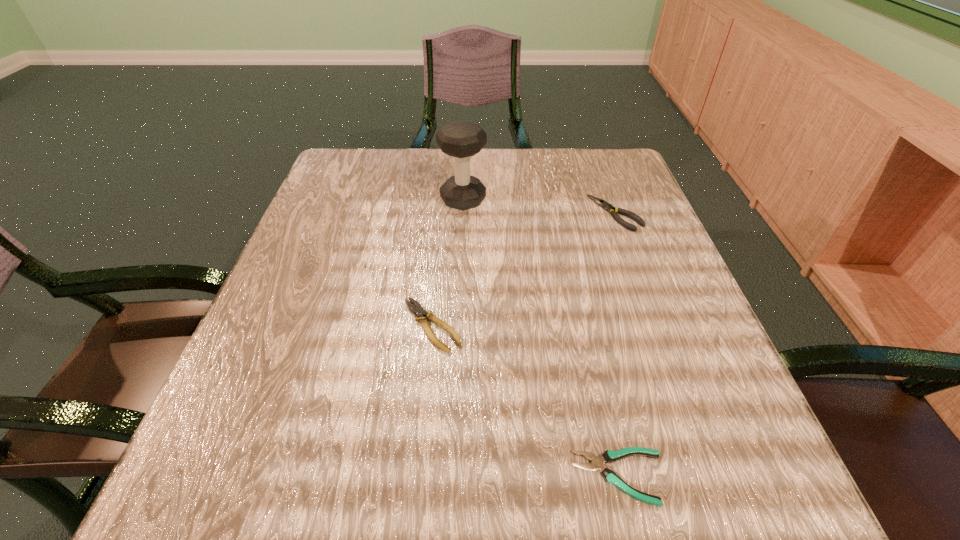
Locate an element on the screen. The height and width of the screenshot is (540, 960). free region at the far right corner is located at coordinates (604, 193).

Image resolution: width=960 pixels, height=540 pixels. I want to click on vacant space at the near right corner, so click(784, 496).

Locate an element on the screen. The height and width of the screenshot is (540, 960). free point between the leftmost pliers and the tallest pliers is located at coordinates (524, 269).

This screenshot has height=540, width=960. Identify the location of empty location between the dumbbell and the leftmost pliers. (447, 263).

Locate an element on the screen. free space that is in between the rightmost object and the second nearest object is located at coordinates (524, 269).

What are the coordinates of `vacant area that lies between the third farthest object and the tallest object` in the screenshot? It's located at (447, 263).

Identify the location of blank region between the second tallest object and the second object from right to left. (617, 345).

Locate an element on the screen. The height and width of the screenshot is (540, 960). unoccupied position between the nearest pliers and the tallest pliers is located at coordinates coord(617,345).

Image resolution: width=960 pixels, height=540 pixels. What are the coordinates of `empty space that is in between the nearest pliers and the second nearest pliers` in the screenshot? It's located at (526, 401).

This screenshot has height=540, width=960. Find the location of `free space between the rightmost pliers and the second pliers from left to right`. free space between the rightmost pliers and the second pliers from left to right is located at coordinates (617, 345).